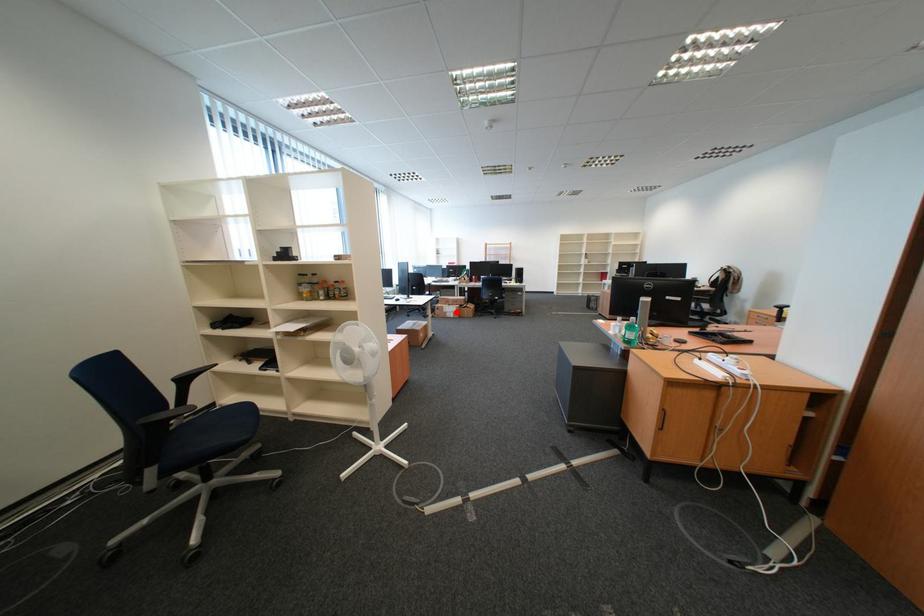
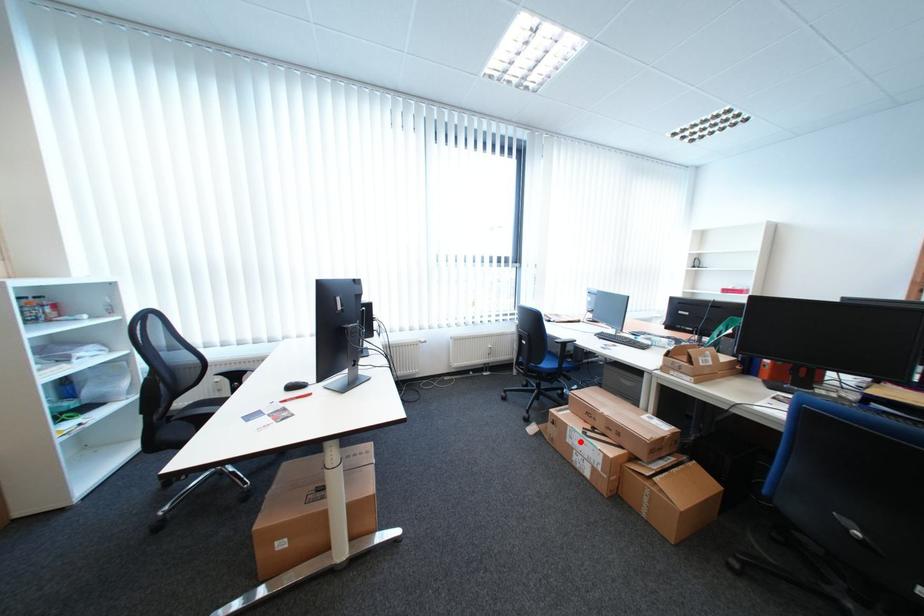
I am providing you with two images of the same scene from different viewpoints. A red point is marked on the first image and another point is marked on the second image. Do the highlighted points in image1 and image2 indicate the same real-world spot?

Yes